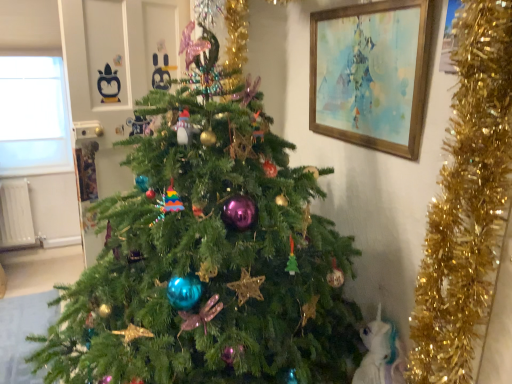
Question: From the image's perspective, would you say white feathered bird at lower right is positioned over transparent glass window at upper left?

Choices:
 (A) no
 (B) yes

Answer: (A)

Question: Could you tell me if white feathered bird at lower right is turned towards transparent glass window at upper left?

Choices:
 (A) yes
 (B) no

Answer: (B)

Question: Is white feathered bird at lower right positioned before transparent glass window at upper left?

Choices:
 (A) yes
 (B) no

Answer: (A)

Question: Considering the relative sizes of white feathered bird at lower right and transparent glass window at upper left in the image provided, is white feathered bird at lower right shorter than transparent glass window at upper left?

Choices:
 (A) yes
 (B) no

Answer: (A)

Question: Is transparent glass window at upper left completely or partially inside white feathered bird at lower right?

Choices:
 (A) yes
 (B) no

Answer: (B)

Question: Is white feathered bird at lower right completely or partially outside of transparent glass window at upper left?

Choices:
 (A) yes
 (B) no

Answer: (A)

Question: From the image's perspective, is wooden framed painting at upper right beneath green matte christmas tree at center?

Choices:
 (A) yes
 (B) no

Answer: (B)

Question: Does wooden framed painting at upper right come behind green matte christmas tree at center?

Choices:
 (A) yes
 (B) no

Answer: (A)

Question: Does wooden framed painting at upper right have a larger size compared to green matte christmas tree at center?

Choices:
 (A) no
 (B) yes

Answer: (A)

Question: Considering the relative positions of wooden framed painting at upper right and green matte christmas tree at center in the image provided, is wooden framed painting at upper right to the right of green matte christmas tree at center from the viewer's perspective?

Choices:
 (A) no
 (B) yes

Answer: (B)

Question: Can you confirm if wooden framed painting at upper right is thinner than green matte christmas tree at center?

Choices:
 (A) no
 (B) yes

Answer: (B)

Question: Is the position of wooden framed painting at upper right less distant than that of green matte christmas tree at center?

Choices:
 (A) no
 (B) yes

Answer: (A)

Question: Considering the relative sizes of transparent glass window at upper left and white feathered bird at lower right in the image provided, is transparent glass window at upper left wider than white feathered bird at lower right?

Choices:
 (A) no
 (B) yes

Answer: (A)